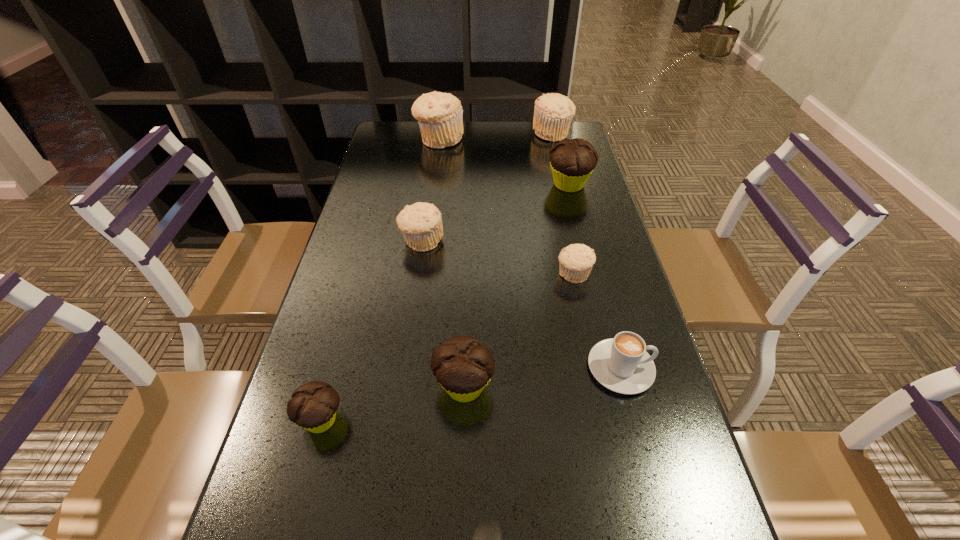
Image resolution: width=960 pixels, height=540 pixels. What are the coordinates of `the tallest object` in the screenshot? It's located at (440, 116).

Where is `the biggest beige muffin`? The width and height of the screenshot is (960, 540). the biggest beige muffin is located at coordinates (440, 116).

This screenshot has height=540, width=960. Find the location of `the third smallest beige muffin`. the third smallest beige muffin is located at coordinates (553, 113).

Identify the location of the third farthest muffin. (572, 161).

The width and height of the screenshot is (960, 540). I want to click on the biggest chocolate muffin, so click(572, 161).

Image resolution: width=960 pixels, height=540 pixels. I want to click on the sixth nearest object, so click(421, 223).

I want to click on the fourth farthest muffin, so click(x=421, y=223).

Where is `the second biggest chocolate muffin`? This screenshot has height=540, width=960. the second biggest chocolate muffin is located at coordinates (463, 366).

Where is `the fifth nearest object`? The width and height of the screenshot is (960, 540). the fifth nearest object is located at coordinates 576,261.

Image resolution: width=960 pixels, height=540 pixels. In order to click on the smallest beige muffin in this screenshot , I will do click(x=576, y=261).